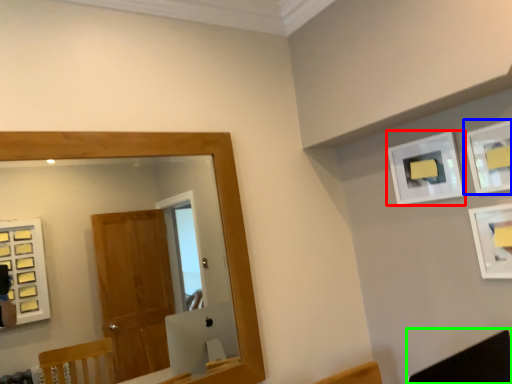
Question: Based on their relative distances, which object is nearer to picture frame (highlighted by a red box)? Choose from picture frame (highlighted by a blue box) and swivel chair (highlighted by a green box).

Choices:
 (A) picture frame
 (B) swivel chair

Answer: (A)